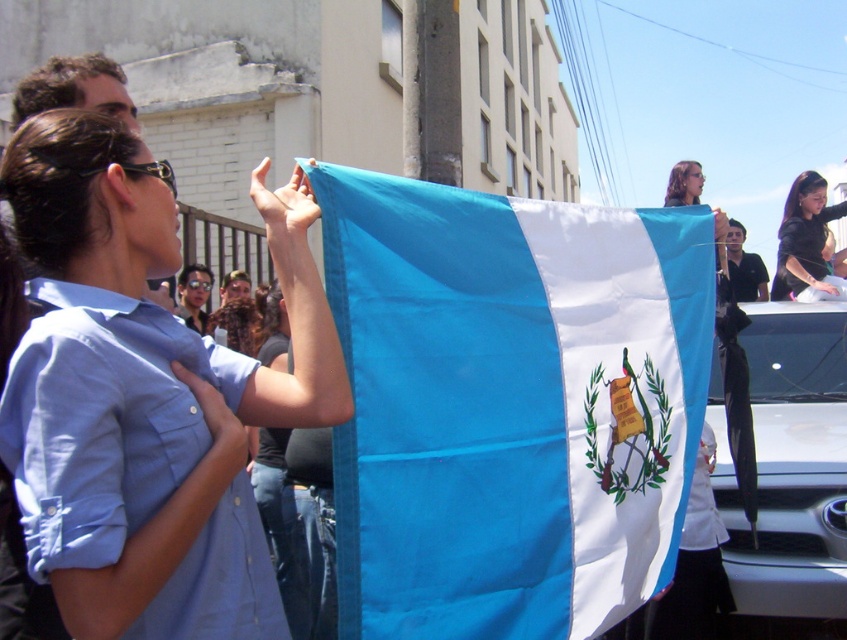
Can you confirm if silky blue flag at center is positioned to the right of white glossy car at lower right?

No, silky blue flag at center is not to the right of white glossy car at lower right.

Who is shorter, silky blue flag at center or white glossy car at lower right?

With less height is silky blue flag at center.

The width and height of the screenshot is (847, 640). Describe the element at coordinates (508, 404) in the screenshot. I see `silky blue flag at center` at that location.

Find the location of a particular element. Image resolution: width=847 pixels, height=640 pixels. silky blue flag at center is located at coordinates (508, 404).

Find the location of a particular element. Image resolution: width=847 pixels, height=640 pixels. silky blue flag at center is located at coordinates (508, 404).

Locate an element on the screen. Image resolution: width=847 pixels, height=640 pixels. silky blue flag at center is located at coordinates (508, 404).

Between blue fabric flag at upper center and white glossy car at lower right, which one has less height?

blue fabric flag at upper center

Does blue fabric flag at upper center appear under white glossy car at lower right?

No, blue fabric flag at upper center is not below white glossy car at lower right.

What do you see at coordinates (144, 394) in the screenshot?
I see `blue fabric flag at upper center` at bounding box center [144, 394].

Find the location of a particular element. This screenshot has height=640, width=847. blue fabric flag at upper center is located at coordinates (144, 394).